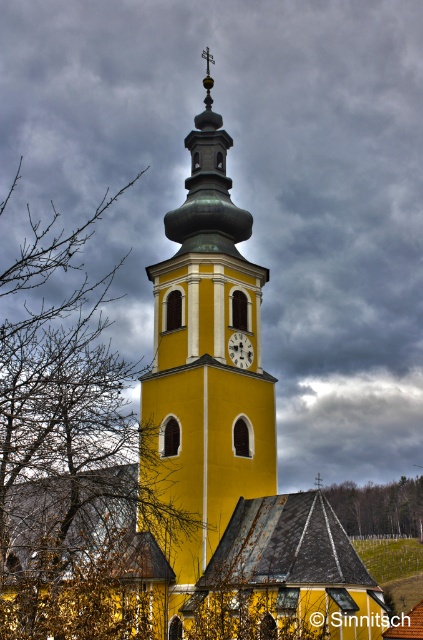
You are an architect evaluating the church tower. From your viewpoint, which object is taller between the bare branches at left and the matte yellow clock at center?

The bare branches at left is taller than the matte yellow clock at center.

Looking at this image, you are standing in front of the yellow church tower and notice a specific point marked at coordinates (77,486). Based on the scene description, where exactly is this point located?

The point at coordinates (77,486) is located on the bare branches at the left side of the image.

You are an architect designing a new garden layout around the yellow matte clock tower at center and the green leafy tree at center. Which structure has a narrower width when viewed from above?

The yellow matte clock tower at center is thinner than the green leafy tree at center, so the yellow matte clock tower at center has a narrower width when viewed from above.